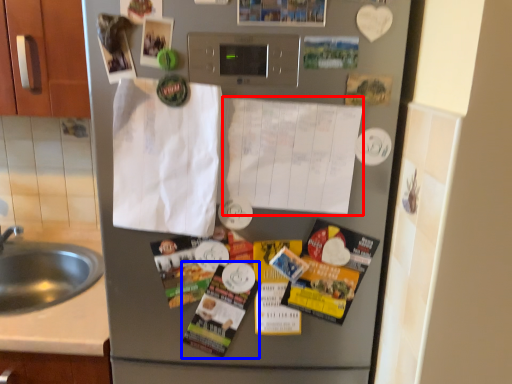
Question: Among these objects, which one is farthest to the camera, paper (highlighted by a red box) or magazine (highlighted by a blue box)?

Choices:
 (A) paper
 (B) magazine

Answer: (B)